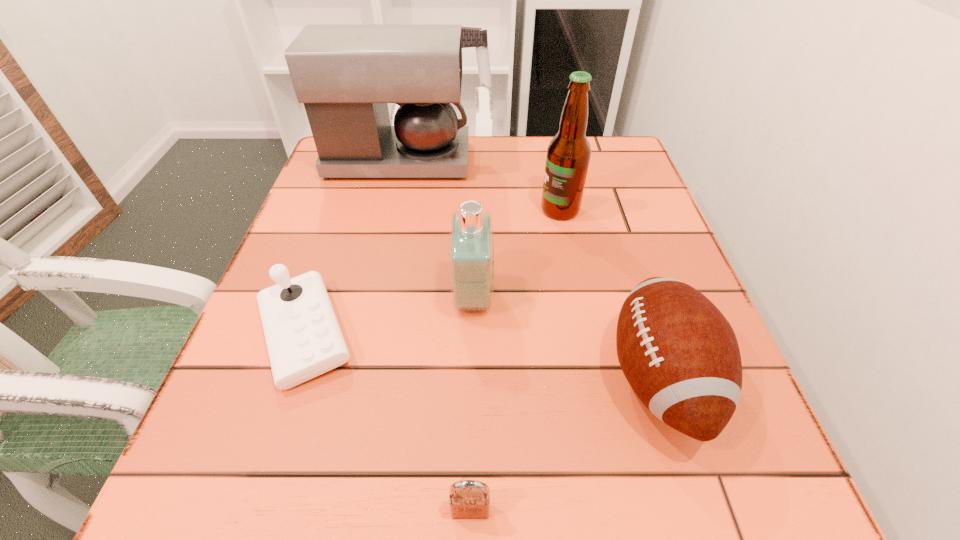
Identify the location of object located at the right edge. The height and width of the screenshot is (540, 960). (x=680, y=355).

Image resolution: width=960 pixels, height=540 pixels. Find the location of `object that is positioned at the far left corner`. object that is positioned at the far left corner is located at coordinates (345, 75).

At what (x,y) coordinates should I click in order to perform the action: click on object that is at the near right corner. Please return your answer as a coordinate pair (x, y). Image resolution: width=960 pixels, height=540 pixels. Looking at the image, I should click on coord(680,355).

The height and width of the screenshot is (540, 960). In the image, there is a desktop. What are the coordinates of `vacant space at the far edge` in the screenshot? It's located at point(551,140).

You are a GUI agent. You are given a task and a screenshot of the screen. Output one action in this format:
    pyautogui.click(x=<x>, y=<y>)
    Task: Click on the free location at the near edge of the desktop
    
    Given the screenshot: What is the action you would take?
    pyautogui.click(x=602, y=488)

Find the location of a particular element. The width and height of the screenshot is (960, 540). vacant region at the left edge of the desktop is located at coordinates (342, 233).

I want to click on vacant space at the right edge of the desktop, so click(x=633, y=210).

You are a GUI agent. You are given a task and a screenshot of the screen. Output one action in this format:
    pyautogui.click(x=<x>, y=<y>)
    Task: Click on the blank space at the far left corner
    This screenshot has width=960, height=540.
    Given the screenshot: What is the action you would take?
    pyautogui.click(x=370, y=184)

In the image, there is a desktop. Identify the location of free space at the near left corner. This screenshot has height=540, width=960. (263, 459).

Image resolution: width=960 pixels, height=540 pixels. I want to click on vacant position at the far right corner of the desktop, so click(632, 170).